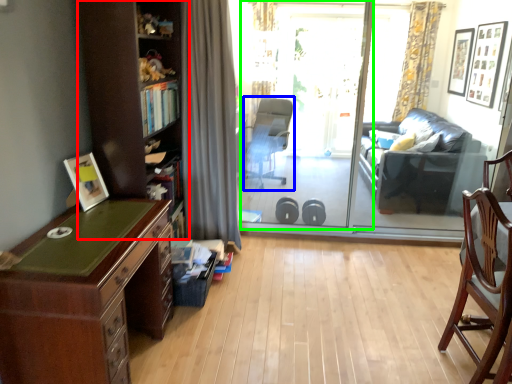
Question: Considering the real-world distances, which object is closest to bookshelf (highlighted by a red box)? chair (highlighted by a blue box) or screen door (highlighted by a green box).

Choices:
 (A) chair
 (B) screen door

Answer: (B)